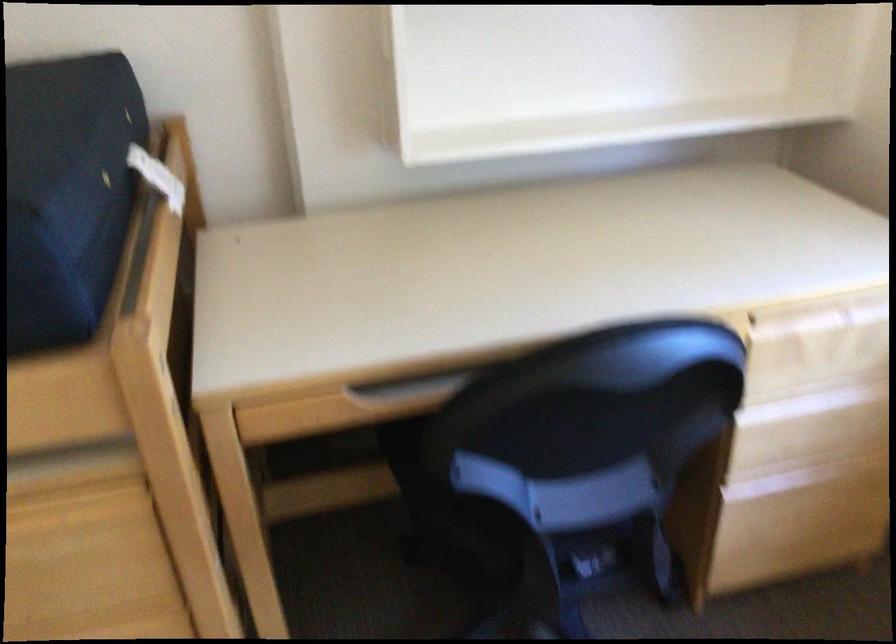
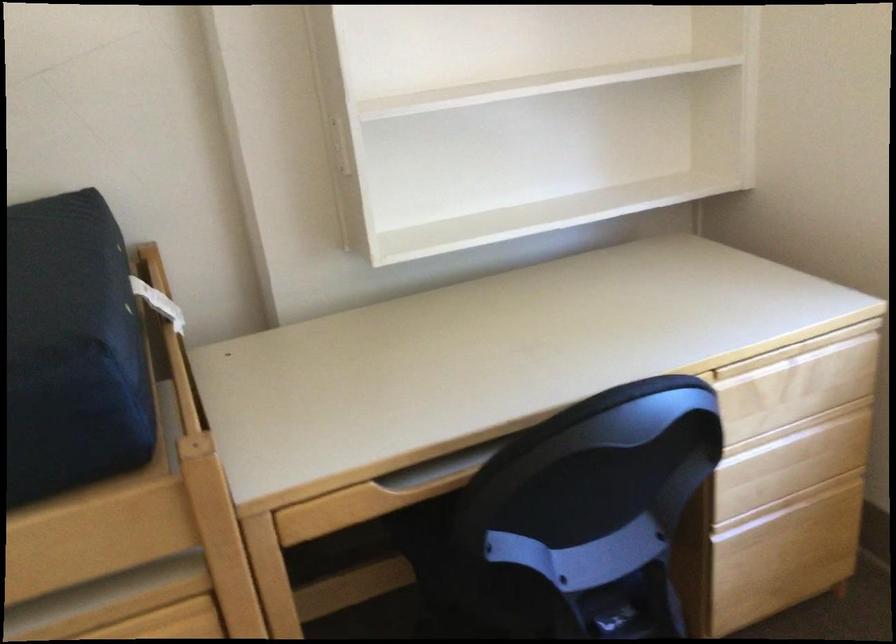
Question: The images are taken continuously from a first-person perspective. In which direction is your viewpoint rotating?

Choices:
 (A) Left
 (B) Right
 (C) Up
 (D) Down

Answer: (C)